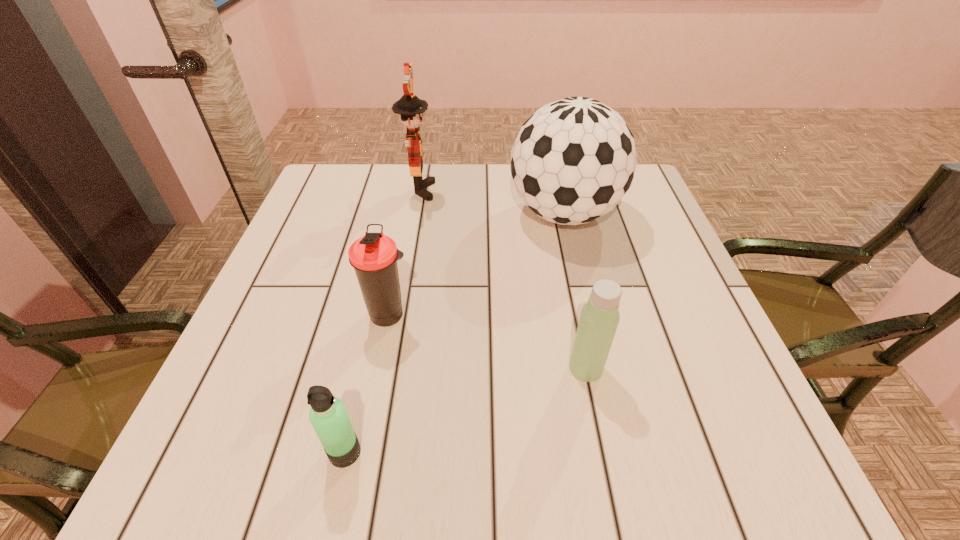
Where is `nutcracker`? nutcracker is located at coordinates (411, 108).

What are the coordinates of `soccer ball` in the screenshot? It's located at (573, 160).

Where is `the farthest thermos bottle`? the farthest thermos bottle is located at coordinates (374, 256).

Where is `the second nearest thermos bottle`? the second nearest thermos bottle is located at coordinates (599, 319).

You are a GUI agent. You are given a task and a screenshot of the screen. Output one action in this format:
    pyautogui.click(x=<x>, y=<y>)
    Task: Click on the rightmost thermos bottle
    The height and width of the screenshot is (540, 960).
    Given the screenshot: What is the action you would take?
    pyautogui.click(x=599, y=319)

Locate an element on the screen. Image resolution: width=960 pixels, height=540 pixels. the nearest object is located at coordinates (328, 416).

The height and width of the screenshot is (540, 960). What are the coordinates of `blank space located on the front-facing side of the nutcracker` in the screenshot? It's located at (457, 190).

Locate an element on the screen. The width and height of the screenshot is (960, 540). vacant space situated 0.300m on the left of the soccer ball is located at coordinates (389, 214).

Where is `vacant space located 0.220m on the right of the third farthest object`? Image resolution: width=960 pixels, height=540 pixels. vacant space located 0.220m on the right of the third farthest object is located at coordinates (525, 315).

Where is `free point located on the left of the second nearest object`? free point located on the left of the second nearest object is located at coordinates (410, 368).